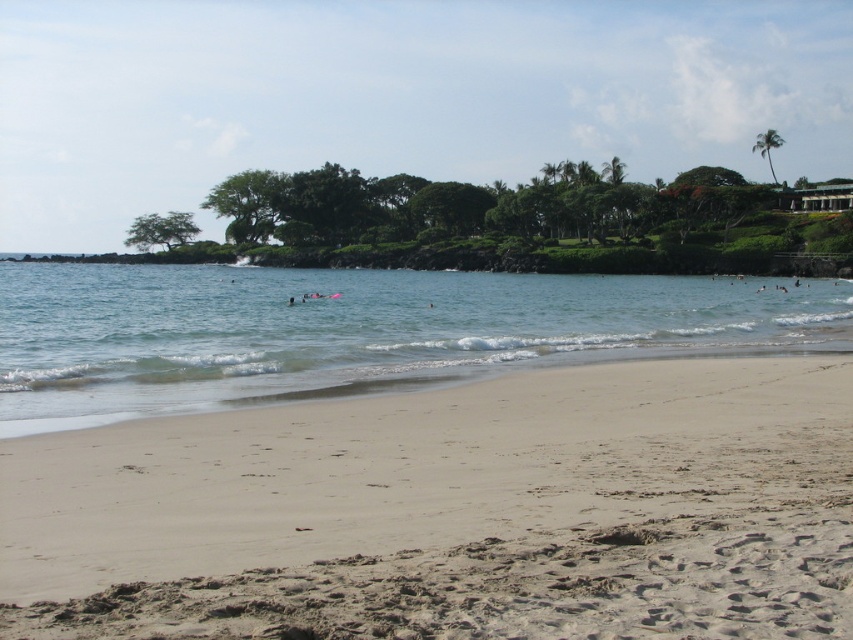
Is light beige sand at lower center thinner than clear blue water at center?

Yes.

Between point (637, 400) and point (427, 312), which one is positioned behind?

Point (427, 312)

You are a GUI agent. You are given a task and a screenshot of the screen. Output one action in this format:
    pyautogui.click(x=<x>, y=<y>)
    Task: Click on the light beige sand at lower center
    
    Given the screenshot: What is the action you would take?
    pyautogui.click(x=451, y=512)